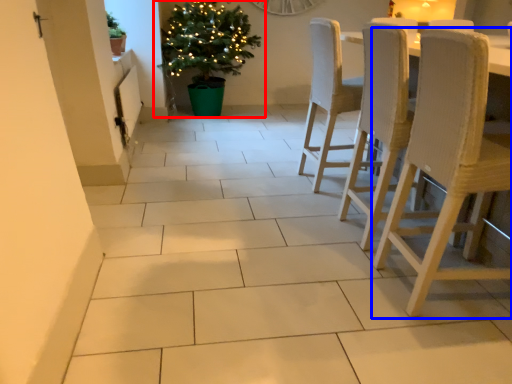
Question: Among these objects, which one is farthest to the camera, houseplant (highlighted by a red box) or chair (highlighted by a blue box)?

Choices:
 (A) houseplant
 (B) chair

Answer: (A)